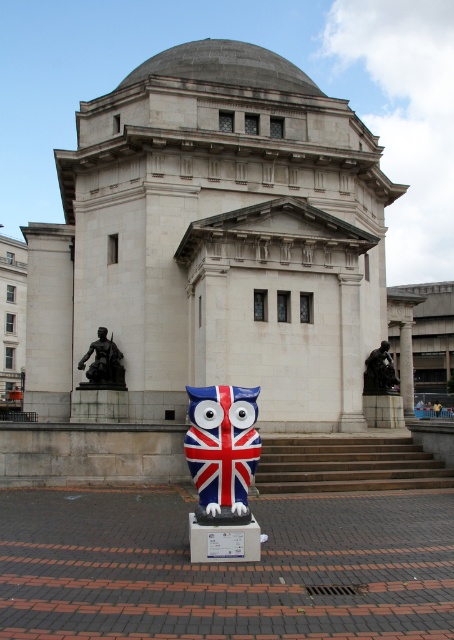
Question: Does union jack painted owl at center appear on the left side of bronze statue at center?

Choices:
 (A) no
 (B) yes

Answer: (B)

Question: Is black polished statue at left bigger than smooth stone statue at right?

Choices:
 (A) no
 (B) yes

Answer: (A)

Question: Which point is closer to the camera?

Choices:
 (A) bronze statue at center
 (B) smooth stone statue at right

Answer: (A)

Question: Is black polished statue at left above bronze statue at center?

Choices:
 (A) no
 (B) yes

Answer: (B)

Question: Which of the following is the closest to the observer?

Choices:
 (A) black polished statue at left
 (B) bronze statue at center
 (C) smooth stone statue at right
 (D) union jack painted owl at center

Answer: (D)

Question: Considering the real-world distances, which object is closest to the smooth stone statue at right?

Choices:
 (A) union jack painted owl at center
 (B) bronze statue at center
 (C) black polished statue at left

Answer: (B)